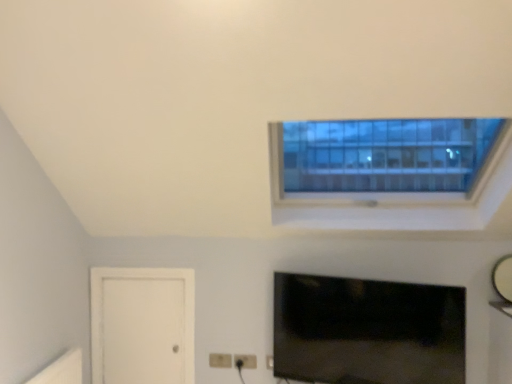
Question: Looking at the image, does white matte door at lower left seem bigger or smaller compared to matte black tv at lower center?

Choices:
 (A) big
 (B) small

Answer: (B)

Question: Is white matte door at lower left taller or shorter than matte black tv at lower center?

Choices:
 (A) tall
 (B) short

Answer: (A)

Question: Which object is positioned farthest from the glossy silver mirror at upper right?

Choices:
 (A) matte black tv at lower center
 (B) white plastic electric outlet at lower center
 (C) white matte door at lower left

Answer: (C)

Question: Estimate the real-world distances between objects in this image. Which object is closer to the matte black tv at lower center?

Choices:
 (A) white plastic electric outlet at lower center
 (B) glossy silver mirror at upper right
 (C) white matte door at lower left

Answer: (A)